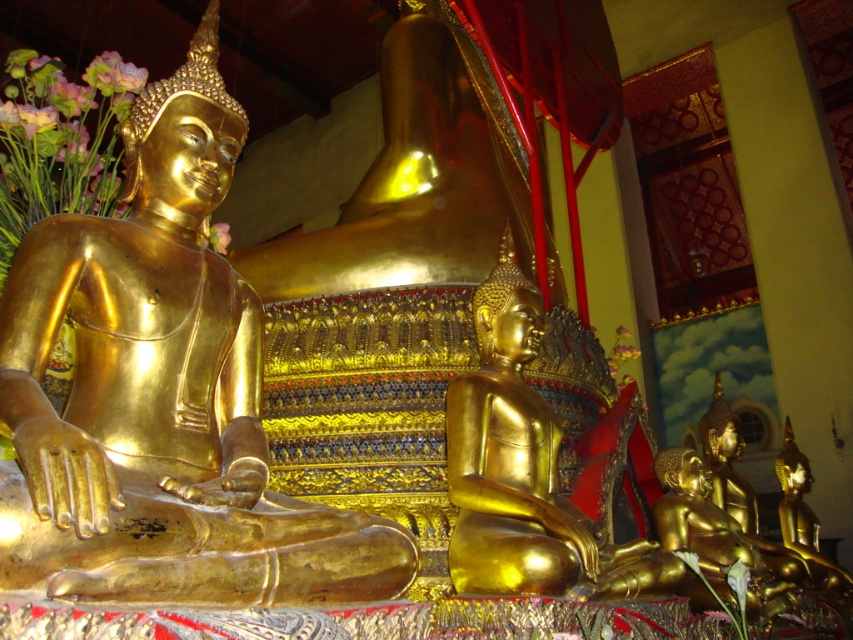
Is gold polished statue at center shorter than pink silk flowers at left?

Incorrect, gold polished statue at center's height does not fall short of pink silk flowers at left's.

Is gold polished statue at center behind pink silk flowers at left?

Yes.

Find the location of a particular element. gold polished statue at center is located at coordinates (416, 177).

Is gold shiny statue at center below pink silk flowers at left?

Correct, gold shiny statue at center is located below pink silk flowers at left.

Is gold shiny statue at center smaller than pink silk flowers at left?

Yes.

Identify the location of gold shiny statue at center. (524, 470).

Does gold shiny statue at left have a greater width compared to gold shiny statue at center?

Indeed, gold shiny statue at left has a greater width compared to gold shiny statue at center.

Is point (169, 368) closer to camera compared to point (590, 588)?

That is True.

This screenshot has width=853, height=640. Find the location of `gold shiny statue at left`. gold shiny statue at left is located at coordinates (161, 394).